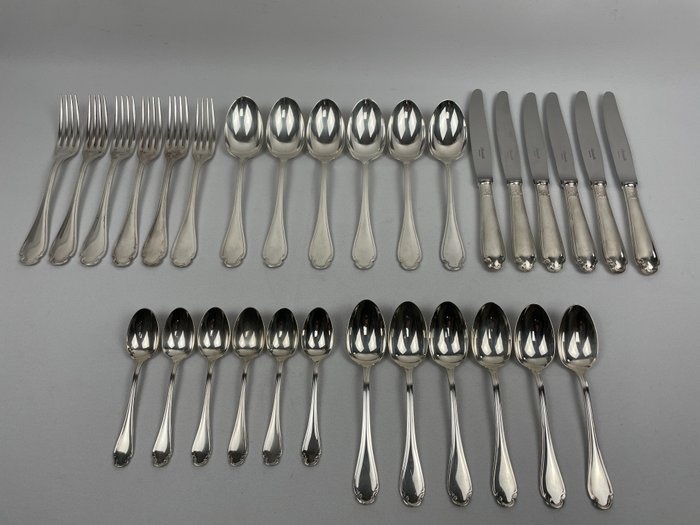
This screenshot has width=700, height=525. Identify the location of four-pronged forks. (68, 120), (92, 123), (119, 121), (144, 124), (172, 120), (203, 123).